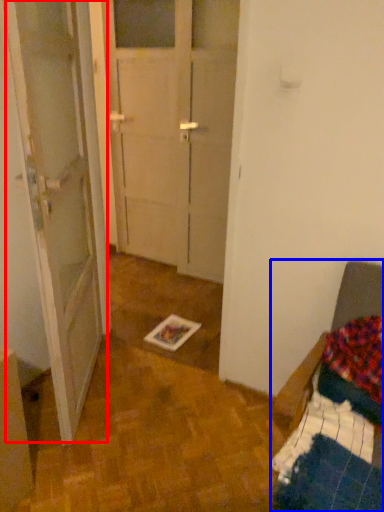
Question: Which object appears closest to the camera in this image, barn door (highlighted by a red box) or furniture (highlighted by a blue box)?

Choices:
 (A) barn door
 (B) furniture

Answer: (B)